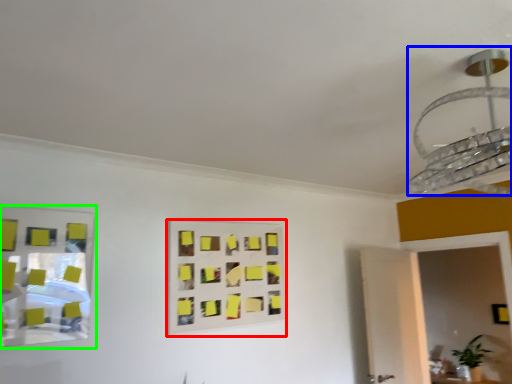
Question: Considering the real-world distances, which object is farthest from rectangle (highlighted by a red box)? lamp (highlighted by a blue box) or mirror (highlighted by a green box)?

Choices:
 (A) lamp
 (B) mirror

Answer: (A)